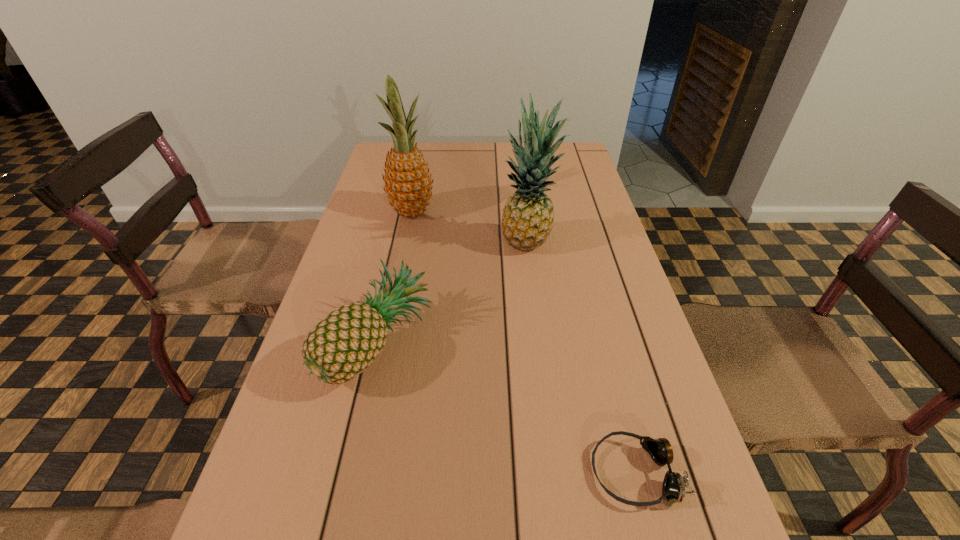
This screenshot has width=960, height=540. I want to click on the third nearest object, so click(x=528, y=216).

At what (x,y) coordinates should I click in order to perform the action: click on the second farthest pineapple. Please return your answer as a coordinate pair (x, y). The image size is (960, 540). Looking at the image, I should click on (528, 216).

This screenshot has height=540, width=960. I want to click on the farthest pineapple, so click(408, 184).

Identify the location of the third tallest object. The image size is (960, 540). coord(340,347).

This screenshot has height=540, width=960. Find the location of `the nearest pineapple`. the nearest pineapple is located at coordinates (340, 347).

The height and width of the screenshot is (540, 960). Identify the location of goggles. (673, 489).

Identify the location of the nearest object. (673, 489).

At what (x,y) coordinates should I click in order to perform the action: click on free space located on the left of the second farthest object. Please return your answer as a coordinate pair (x, y). The height and width of the screenshot is (540, 960). Looking at the image, I should click on (479, 245).

What are the coordinates of `free location located on the front of the farthest pineapple` in the screenshot? It's located at (400, 269).

At what (x,y) coordinates should I click in order to perform the action: click on vacant space located 0.200m on the front of the second nearest object. Please return your answer as a coordinate pair (x, y). The width and height of the screenshot is (960, 540). Looking at the image, I should click on (342, 515).